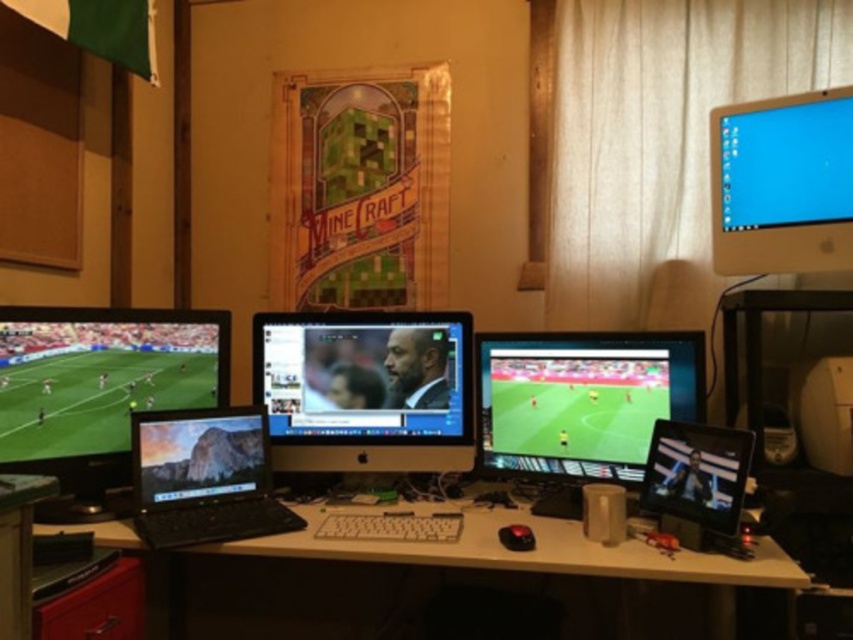
You are standing at the point labeled as point (67, 515) and want to take a photo of the entire desk setup. The camera you have can capture a clear image up to 1.6 meters away. Will the camera be able to capture the entire desk in one shot?

The distance between point (67, 515) and the camera is 1.63 meters, which is slightly beyond the camera maximum range of 1.6 meters. Therefore, the camera will not be able to capture the entire desk in one clear shot.

You are trying to locate the satin black monitor at center in the workspace. According to the coordinates provided, where would you find it?

The satin black monitor at center is located at point (366,388).

You are organizing an online conference and need to place a 1.2 meter wide banner on the desk. The banner must be placed between the white glossy monitor at upper right and the white matte computer desk at center. Is there enough space for the banner?

The white glossy monitor at upper right is less in width than the white matte computer desk at center. However, the exact dimensions of the space between them are not provided. Therefore, it is uncertain if the 1.2 meter wide banner will fit.